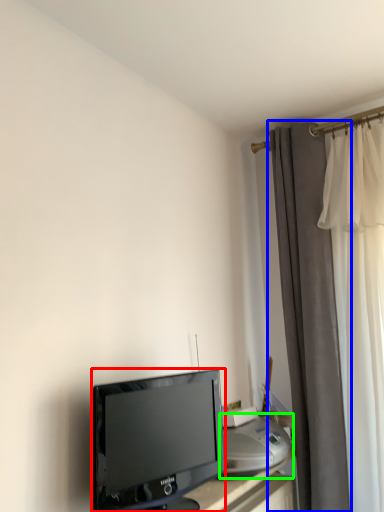
Question: Which object is positioned farthest from television (highlighted by a red box)? Select from curtain (highlighted by a blue box) and printer (highlighted by a green box).

Choices:
 (A) curtain
 (B) printer

Answer: (A)